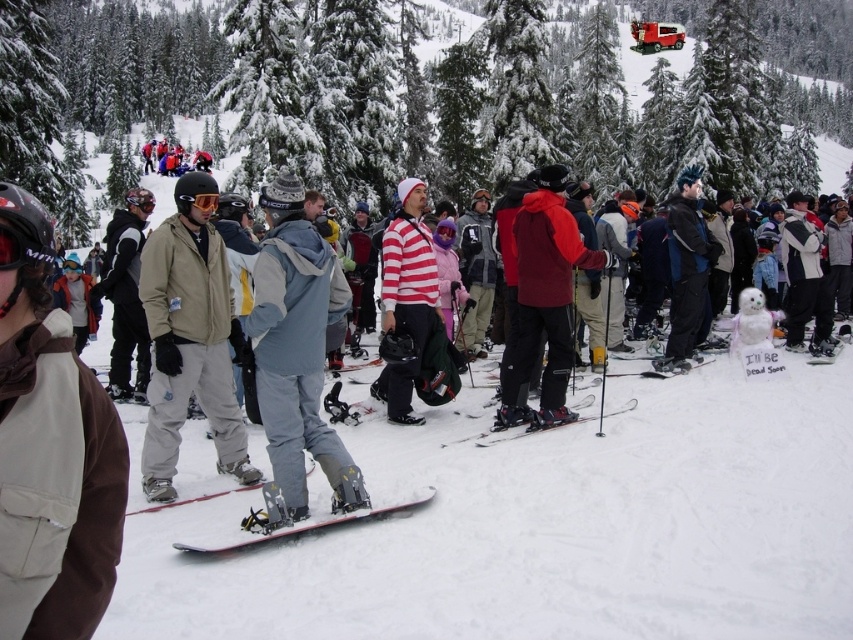
Question: Among these objects, which one is farthest from the camera?

Choices:
 (A) matte gray snowboard at center
 (B) black matte ski at center
 (C) green textured snowboard at center
 (D) red matte jacket at center

Answer: (C)

Question: Does brown fabric jacket at center appear on the right side of beige fabric jacket at center?

Choices:
 (A) yes
 (B) no

Answer: (A)

Question: Which of these objects is positioned closest to the white matte snowboard at center?

Choices:
 (A) green textured snowboard at center
 (B) striped cotton shirt at center
 (C) brown fabric jacket at center

Answer: (B)

Question: Can you confirm if green textured snowboard at left is thinner than matte gray snowboard at center?

Choices:
 (A) yes
 (B) no

Answer: (B)

Question: Can you confirm if gray fabric snowsuit at center is positioned above striped cotton shirt at center?

Choices:
 (A) no
 (B) yes

Answer: (A)

Question: Which of the following is the farthest from the observer?

Choices:
 (A) (15, 365)
 (B) (10, 179)
 (C) (467, 436)

Answer: (B)